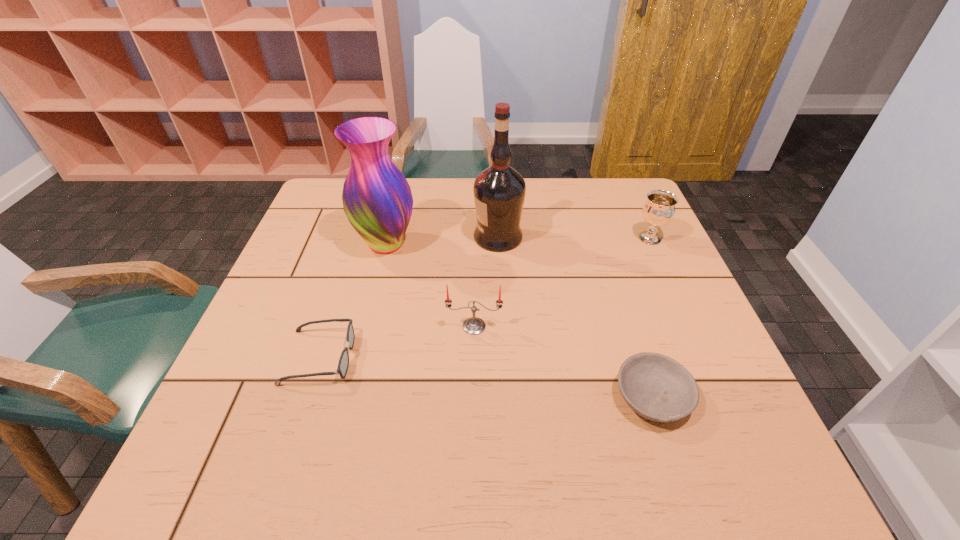
The height and width of the screenshot is (540, 960). I want to click on vacant region at the right edge, so click(744, 413).

In the image, there is a desktop. At what (x,y) coordinates should I click in order to perform the action: click on vacant space at the far left corner. Please return your answer as a coordinate pair (x, y). This screenshot has width=960, height=540. Looking at the image, I should click on (341, 185).

You are a GUI agent. You are given a task and a screenshot of the screen. Output one action in this format:
    pyautogui.click(x=<x>, y=<y>)
    Task: Click on the vacant space at the far right corner
    The height and width of the screenshot is (540, 960).
    Given the screenshot: What is the action you would take?
    pyautogui.click(x=613, y=188)

In the image, there is a desktop. At what (x,y) coordinates should I click in order to perform the action: click on free space at the near right corner. Please return your answer as a coordinate pair (x, y). Looking at the image, I should click on (747, 449).

The width and height of the screenshot is (960, 540). I want to click on empty location between the rightmost object and the spectacles, so click(x=485, y=298).

I want to click on unoccupied area between the candle and the spectacles, so click(396, 342).

Locate an element on the screen. This screenshot has height=540, width=960. vacant space in between the second object from right to left and the candle is located at coordinates (564, 362).

In order to click on vacant space that is in between the liquor and the candle in this screenshot , I will do `click(486, 282)`.

I want to click on free area in between the fifth object from left to right and the spectacles, so click(x=486, y=377).

Locate an element on the screen. free spot between the bowl and the vase is located at coordinates (519, 321).